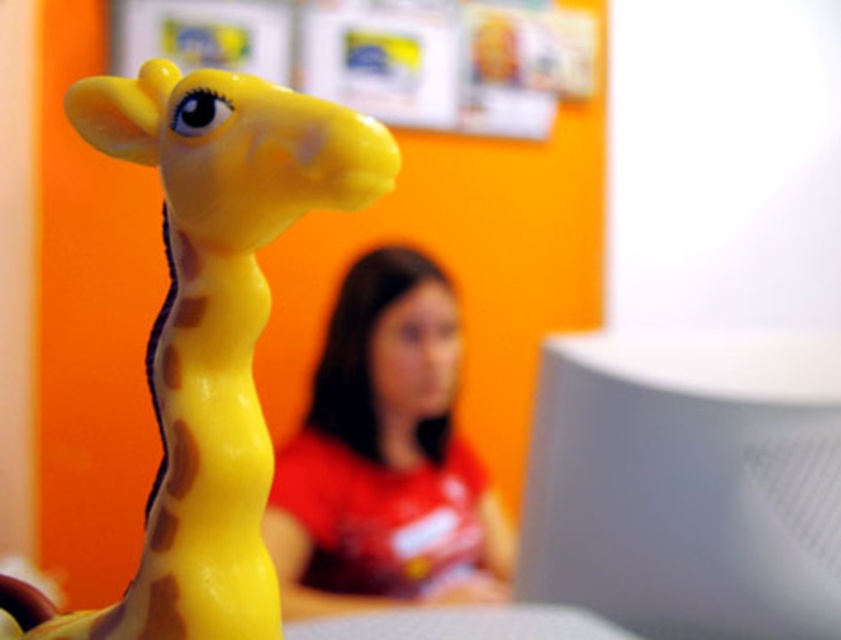
Question: Considering the real-world distances, which object is closest to the matte red shirt at center?

Choices:
 (A) white matte computer monitor at right
 (B) matte plastic giraffe at center

Answer: (A)

Question: Does matte plastic giraffe at center appear under matte red shirt at center?

Choices:
 (A) no
 (B) yes

Answer: (A)

Question: From the image, what is the correct spatial relationship of matte plastic giraffe at center in relation to matte red shirt at center?

Choices:
 (A) right
 (B) left

Answer: (B)

Question: Which point is closer to the camera?

Choices:
 (A) (426, 416)
 (B) (268, 202)

Answer: (B)

Question: Is white matte computer monitor at right to the left of matte plastic giraffe at center from the viewer's perspective?

Choices:
 (A) yes
 (B) no

Answer: (B)

Question: Which of these objects is positioned closest to the matte plastic giraffe at center?

Choices:
 (A) matte red shirt at center
 (B) white matte computer monitor at right

Answer: (B)